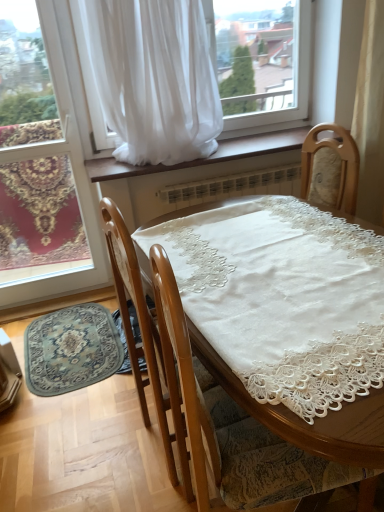
You are a GUI agent. You are given a task and a screenshot of the screen. Output one action in this format:
    pyautogui.click(x=<x>, y=<y>)
    Task: Click on the matte glass window at lower left
    The image size is (384, 512).
    Given the screenshot: What is the action you would take?
    pyautogui.click(x=73, y=179)

Describe the element at coordinates (154, 78) in the screenshot. This screenshot has height=512, width=384. I see `white sheer curtain at upper center` at that location.

Identify the location of wooden chair at center. (200, 404).

What do you see at coordinates (71, 349) in the screenshot?
I see `blue patterned rug at lower left` at bounding box center [71, 349].

Where is `matte glass window at lower left`? This screenshot has height=512, width=384. matte glass window at lower left is located at coordinates (73, 179).

Which is closer to the camera, (181,439) or (237,150)?

Positioned in front is point (181,439).

Considering the sizes of objects wooden chair at center and brown wood at center in the image provided, who is bigger, wooden chair at center or brown wood at center?

Bigger between the two is wooden chair at center.

Based on their positions, is wooden chair at center located to the left or right of brown wood at center?

From the image, it's evident that wooden chair at center is to the right of brown wood at center.

Locate an element on the screen. window on the left of brown wood at center is located at coordinates (73, 179).

From a real-world perspective, is matte glass window at lower left physically located above or below brown wood at center?

From a real-world perspective, matte glass window at lower left is physically below brown wood at center.

Between matte glass window at lower left and brown wood at center, which one has smaller size?

Smaller between the two is brown wood at center.

Relative to brown wood at center, is matte glass window at lower left in front or behind?

matte glass window at lower left is in front of brown wood at center.

From the image's perspective, is matte glass window at lower left located beneath white sheer curtain at upper center?

Correct, matte glass window at lower left appears lower than white sheer curtain at upper center in the image.

In the image, is matte glass window at lower left positioned in front of or behind white sheer curtain at upper center?

Clearly, matte glass window at lower left is behind white sheer curtain at upper center.

Which of these two, matte glass window at lower left or white sheer curtain at upper center, is smaller?

With smaller size is matte glass window at lower left.

Which is more to the right, brown wood at center or white sheer curtain at upper center?

Positioned to the right is brown wood at center.

Is point (275, 132) closer to camera compared to point (198, 56)?

No.

Which object is further away from the camera taking this photo, brown wood at center or white sheer curtain at upper center?

brown wood at center is behind.

This screenshot has width=384, height=512. Find the location of `curtain above the brown wood at center (from the image's perspective)`. curtain above the brown wood at center (from the image's perspective) is located at coordinates (154, 78).

Which is more to the right, white sheer curtain at upper center or matte glass window at lower left?

From the viewer's perspective, white sheer curtain at upper center appears more on the right side.

Is matte glass window at lower left at the back of white sheer curtain at upper center?

white sheer curtain at upper center is not turned away from matte glass window at lower left.

At what (x,y) coordinates should I click in order to perform the action: click on curtain above the matte glass window at lower left (from the image's perspective). Please return your answer as a coordinate pair (x, y). Looking at the image, I should click on (154, 78).

Between white sheer curtain at upper center and matte glass window at lower left, which one is positioned behind?

matte glass window at lower left is further from the camera.

Is blue patterned rug at lower left at the left side of brown wood at center?

Yes.

Which of these two, blue patterned rug at lower left or brown wood at center, is bigger?

Bigger between the two is brown wood at center.

From the picture: Is the surface of blue patterned rug at lower left in direct contact with brown wood at center?

No, blue patterned rug at lower left is not next to brown wood at center.

Considering the relative sizes of blue patterned rug at lower left and brown wood at center in the image provided, is blue patterned rug at lower left thinner than brown wood at center?

In fact, blue patterned rug at lower left might be wider than brown wood at center.

Locate an element on the screen. This screenshot has width=384, height=512. curtain in front of the blue patterned rug at lower left is located at coordinates (154, 78).

Between white sheer curtain at upper center and blue patterned rug at lower left, which one appears on the right side from the viewer's perspective?

white sheer curtain at upper center.

Is white sheer curtain at upper center completely or partially outside of blue patterned rug at lower left?

That's correct, white sheer curtain at upper center is outside of blue patterned rug at lower left.

Where is `window sill lying above the wooden chair at center (from the image's perspective)`? window sill lying above the wooden chair at center (from the image's perspective) is located at coordinates tap(204, 158).

What are the coordinates of `window sill above the matte glass window at lower left (from a real-world perspective)` in the screenshot? It's located at (204, 158).

Considering their positions, is brown wood at center positioned further to white sheer curtain at upper center than wooden chair at center?

The object further to white sheer curtain at upper center is wooden chair at center.

In the scene shown: Looking at the image, which one is located closer to blue patterned rug at lower left, brown wood at center or white sheer curtain at upper center?

Among the two, brown wood at center is located nearer to blue patterned rug at lower left.

Considering their positions, is wooden chair at center positioned further to matte glass window at lower left than blue patterned rug at lower left?

The object further to matte glass window at lower left is wooden chair at center.

Estimate the real-world distances between objects in this image. Which object is further from brown wood at center, blue patterned rug at lower left or white sheer curtain at upper center?

blue patterned rug at lower left lies further to brown wood at center than the other object.

Estimate the real-world distances between objects in this image. Which object is closer to blue patterned rug at lower left, white sheer curtain at upper center or brown wood at center?

The object closer to blue patterned rug at lower left is brown wood at center.

Looking at the image, which one is located further to matte glass window at lower left, white sheer curtain at upper center or brown wood at center?

brown wood at center.

When comparing their distances from wooden chair at center, does brown wood at center or blue patterned rug at lower left seem closer?

Based on the image, blue patterned rug at lower left appears to be nearer to wooden chair at center.

Looking at the image, which one is located closer to brown wood at center, wooden chair at center or matte glass window at lower left?

matte glass window at lower left.

At what (x,y) coordinates should I click in order to perform the action: click on curtain situated between matte glass window at lower left and brown wood at center from left to right. Please return your answer as a coordinate pair (x, y). The width and height of the screenshot is (384, 512). Looking at the image, I should click on (154, 78).

At what (x,y) coordinates should I click in order to perform the action: click on window that lies between white sheer curtain at upper center and blue patterned rug at lower left from top to bottom. Please return your answer as a coordinate pair (x, y). Looking at the image, I should click on (73, 179).

Identify the location of window located between wooden chair at center and blue patterned rug at lower left in the depth direction. This screenshot has height=512, width=384. (73, 179).

Identify the location of curtain between wooden chair at center and brown wood at center from front to back. click(x=154, y=78).